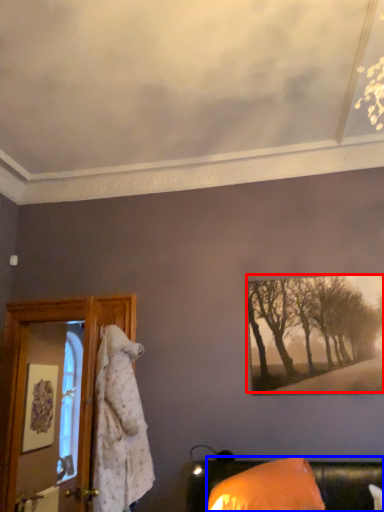
Question: Which of the following is the farthest to the observer, tree (highlighted by a red box) or furniture (highlighted by a blue box)?

Choices:
 (A) tree
 (B) furniture

Answer: (A)